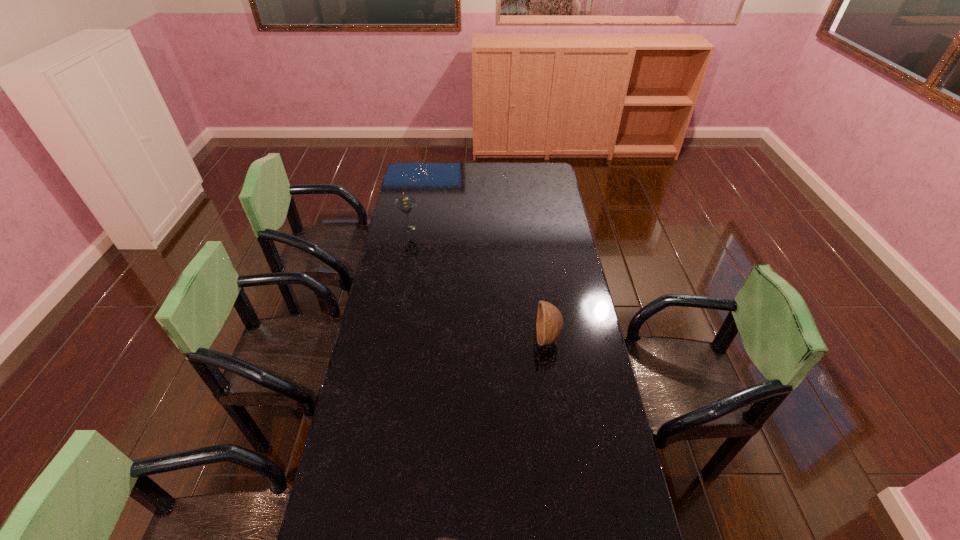
Where is `the leftmost object`? The height and width of the screenshot is (540, 960). the leftmost object is located at coordinates (406, 203).

Locate an element on the screen. The height and width of the screenshot is (540, 960). the farthest object is located at coordinates (406, 203).

Image resolution: width=960 pixels, height=540 pixels. I want to click on bowl, so click(549, 326).

Where is `the second farthest object`? the second farthest object is located at coordinates (549, 326).

Find the location of a particular element. The width and height of the screenshot is (960, 540). vacant area situated on the back of the martini is located at coordinates (412, 213).

Find the location of a particular element. The width and height of the screenshot is (960, 540). vacant space located on the left of the bowl is located at coordinates (483, 338).

Find the location of `object that is positioned at the left edge`. object that is positioned at the left edge is located at coordinates (406, 203).

Where is `object located at the right edge`? The height and width of the screenshot is (540, 960). object located at the right edge is located at coordinates (549, 326).

Locate an element on the screen. vacant area at the far edge is located at coordinates (482, 175).

In the image, there is a desktop. Find the location of `vacant space at the left edge`. vacant space at the left edge is located at coordinates (418, 279).